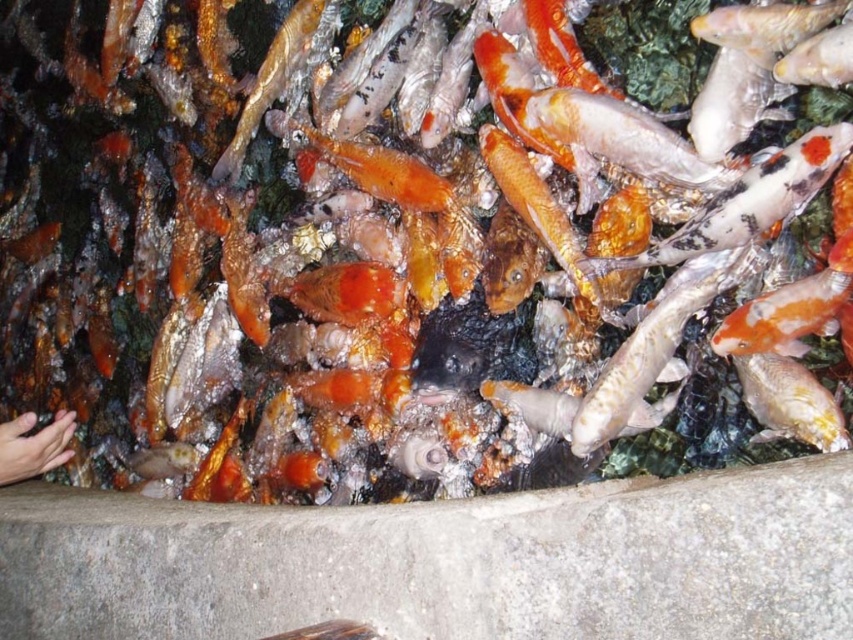
Question: Can you confirm if shiny gold fish at upper left is positioned to the left of smooth skin hand at lower left?

Choices:
 (A) yes
 (B) no

Answer: (B)

Question: Is shiny silver fish at center to the right of shiny gold fish at upper left from the viewer's perspective?

Choices:
 (A) no
 (B) yes

Answer: (B)

Question: Among these objects, which one is farthest from the camera?

Choices:
 (A) smooth skin hand at lower left
 (B) shiny gold fish at upper left

Answer: (B)

Question: Which is farther from the shiny silver fish at center?

Choices:
 (A) smooth skin hand at lower left
 (B) shiny gold fish at upper left

Answer: (A)

Question: Where is shiny silver fish at center located in relation to shiny gold fish at upper left in the image?

Choices:
 (A) above
 (B) below

Answer: (B)

Question: Which object appears farthest from the camera in this image?

Choices:
 (A) shiny silver fish at center
 (B) smooth skin hand at lower left

Answer: (B)